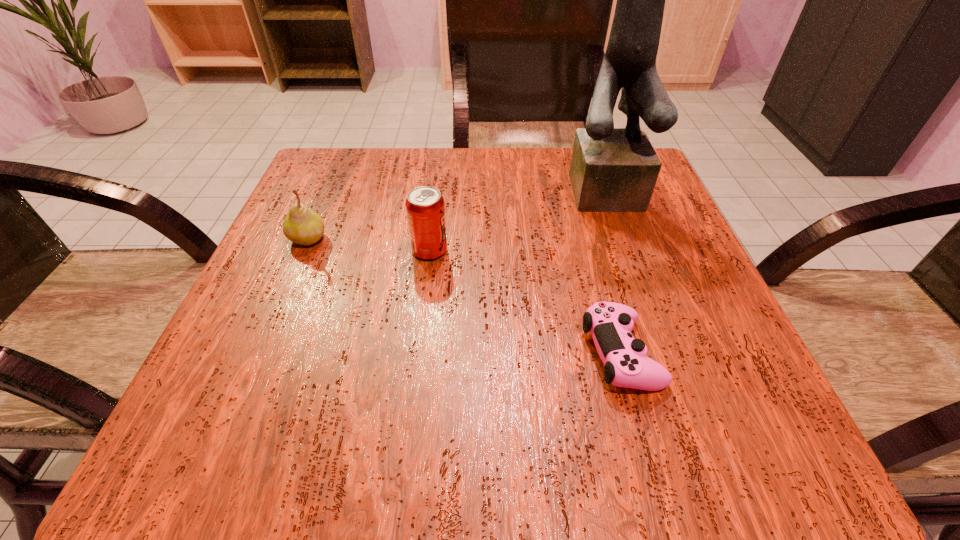
What are the coordinates of `free space between the third object from right to left and the shortest object` in the screenshot? It's located at (525, 302).

Identify which object is the third closest to the nearest object. Please provide its 2D coordinates. Your answer should be formatted as a tuple, i.e. [(x, y)], where the tuple contains the x and y coordinates of a point satisfying the conditions above.

[(301, 225)]

Identify the location of object that stands as the third closest to the second object from left to right. (612, 170).

This screenshot has height=540, width=960. In order to click on blank space that satisfies the following two spatial constraints: 1. on the front side of the nearest object; 2. on the left side of the soda can in this screenshot , I will do `click(418, 354)`.

This screenshot has height=540, width=960. I want to click on vacant region that satisfies the following two spatial constraints: 1. on the front side of the pear; 2. on the left side of the soda can, so click(302, 251).